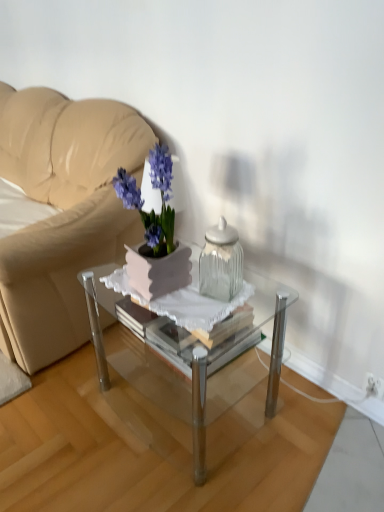
At what (x,y) coordinates should I click in order to perform the action: click on free space that is in between clear glass coffee table at center and white plastic electric outlet at lower right. Please return your answer as a coordinate pair (x, y). The width and height of the screenshot is (384, 512). Looking at the image, I should click on (298, 416).